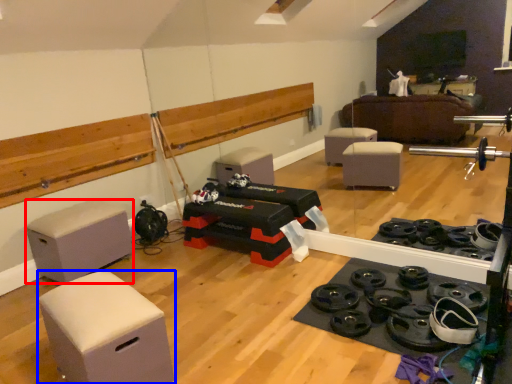
Question: Which of the following is the farthest to the observer, furniture (highlighted by a red box) or furniture (highlighted by a blue box)?

Choices:
 (A) furniture
 (B) furniture

Answer: (A)